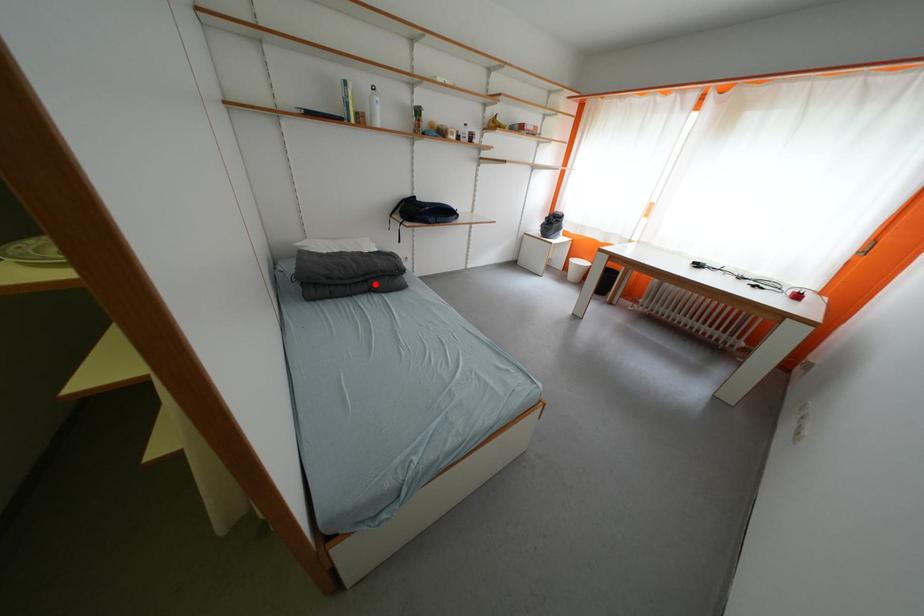
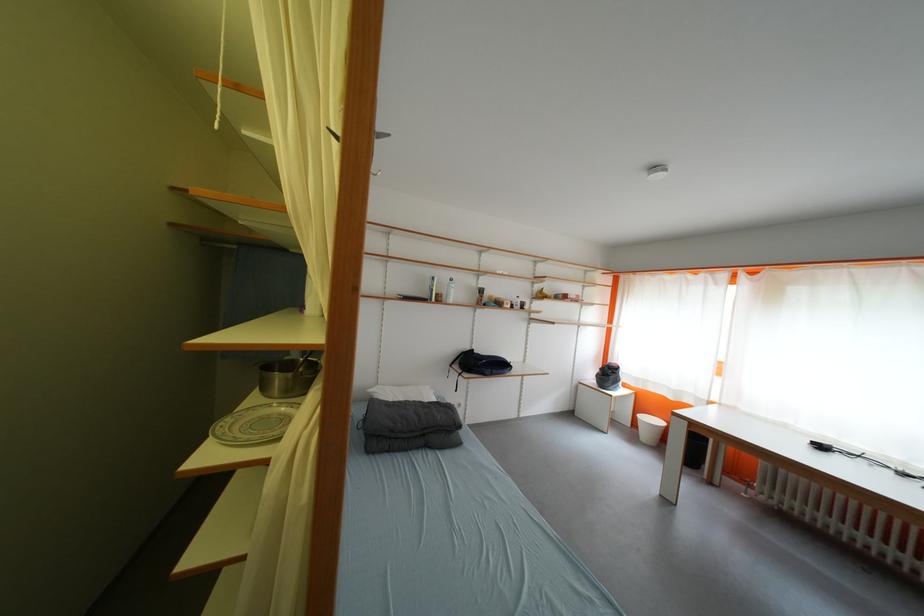
Locate, in the second image, the point that corresponds to the highlighted location in the first image.

(432, 438)